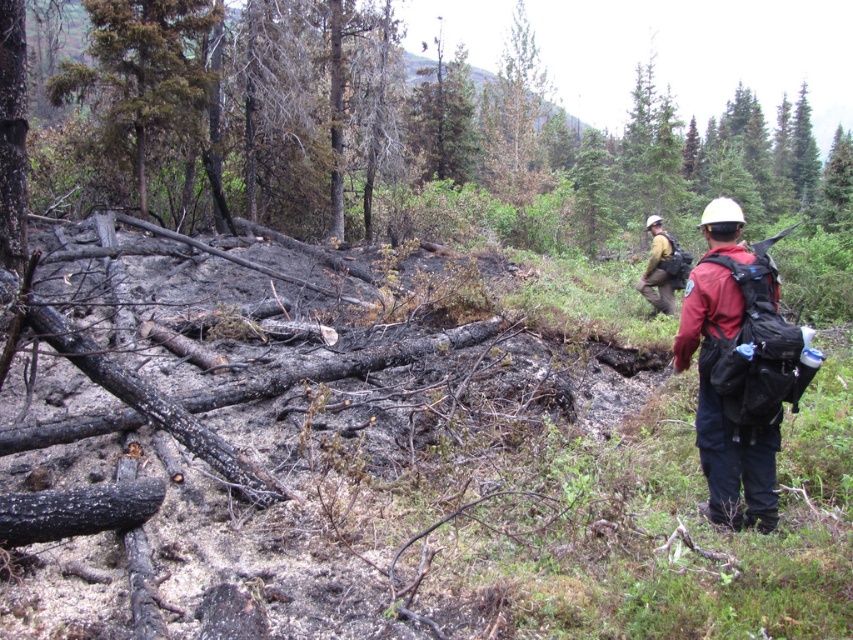
You are a hiker who has just spotted a matte red jacket at right and a dark green coniferous tree at upper left in the forest. From your current position, which object is closer to you?

The matte red jacket at right is closer to you because it is located below the dark green coniferous tree at upper left, indicating it is positioned lower in the visual plane and thus nearer in the scene.

You are a hiker who has just entered the forest and notices two jackets hanging from a tree branch on the right side of the path. The jackets are described as a matte red jacket at right and a camouflage jacket at right. Which jacket is smaller in size?

The matte red jacket at right is smaller than the camouflage jacket at right.